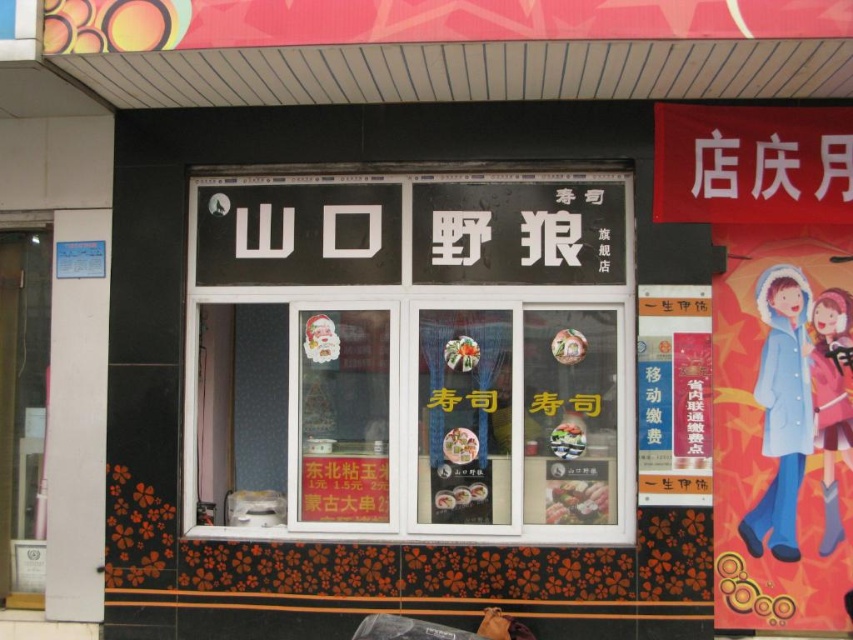
Question: Which object is positioned closest to the pastel pink fabric at right?

Choices:
 (A) blue fabric coat at right
 (B) black glass shop window at center

Answer: (A)

Question: Can you confirm if blue fabric coat at right is wider than pastel pink fabric at right?

Choices:
 (A) yes
 (B) no

Answer: (A)

Question: Considering the relative positions of black glass shop window at center and pastel pink fabric at right in the image provided, where is black glass shop window at center located with respect to pastel pink fabric at right?

Choices:
 (A) right
 (B) left

Answer: (B)

Question: Based on their relative distances, which object is nearer to the blue fabric coat at right?

Choices:
 (A) black glass shop window at center
 (B) pastel pink fabric at right

Answer: (B)

Question: Which of the following is the closest to the observer?

Choices:
 (A) black glass shop window at center
 (B) pastel pink fabric at right
 (C) blue fabric coat at right

Answer: (B)

Question: From the image, what is the correct spatial relationship of blue fabric coat at right in relation to pastel pink fabric at right?

Choices:
 (A) left
 (B) right

Answer: (A)